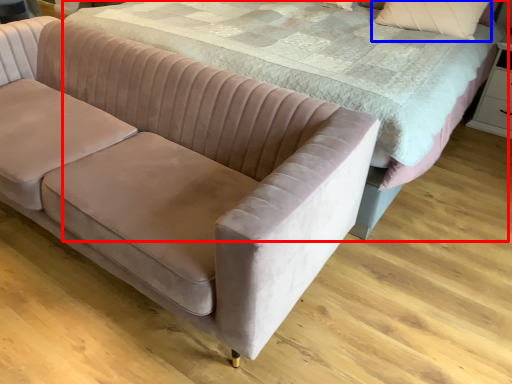
Question: Which point is closer to the camera, bed (highlighted by a red box) or pillow (highlighted by a blue box)?

Choices:
 (A) bed
 (B) pillow

Answer: (A)